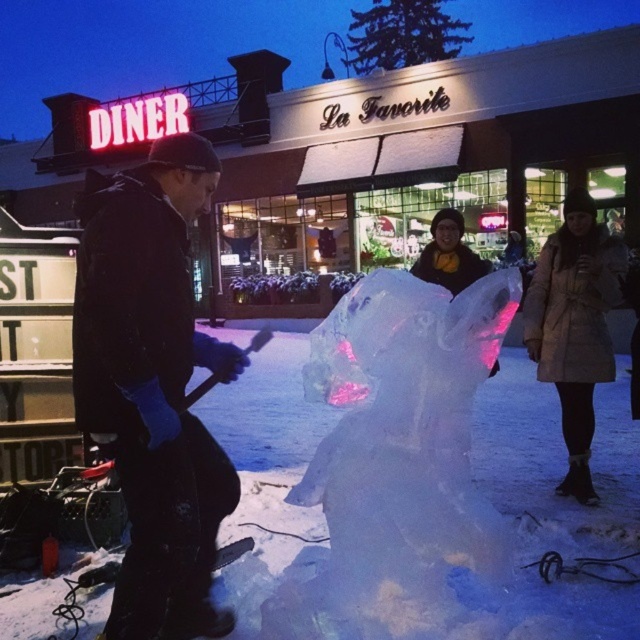
Can you confirm if black matte jacket at left is thinner than beige down coat at right?

In fact, black matte jacket at left might be wider than beige down coat at right.

Which is above, black matte jacket at left or beige down coat at right?

beige down coat at right is higher up.

Which is behind, point (164, 305) or point (589, 339)?

The point (589, 339) is more distant.

What are the coordinates of `black matte jacket at left` in the screenshot? It's located at (154, 387).